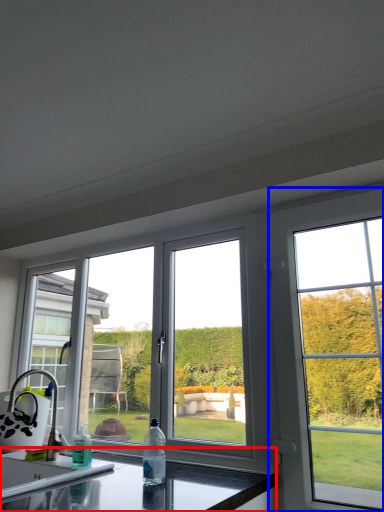
Question: Which point is further to the camera, countertop (highlighted by a red box) or window (highlighted by a blue box)?

Choices:
 (A) countertop
 (B) window

Answer: (B)